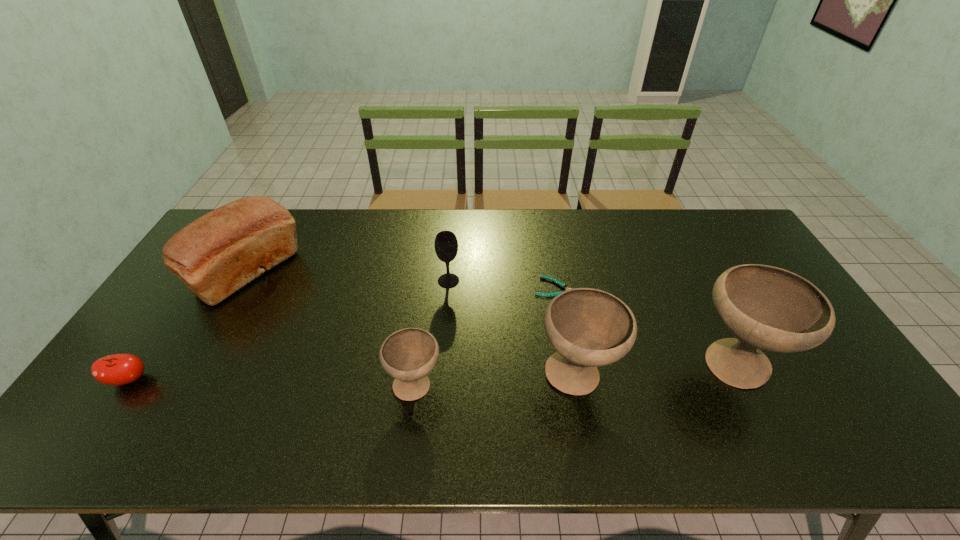
This screenshot has height=540, width=960. What are the coordinates of `vacant space that's between the wineglass and the second shortest object` in the screenshot? It's located at (289, 330).

Locate an element on the screen. Image resolution: width=960 pixels, height=540 pixels. vacant space that is in between the pliers and the apple is located at coordinates (344, 333).

Identify the location of vacant region between the second shortest object and the fourth tallest object. (289, 330).

I want to click on free space between the bread and the second shortest object, so click(189, 326).

Choose which object is the second nearest neighbor to the fourth shortest object. Please provide its 2D coordinates. Your answer should be formatted as a tuple, i.e. [(x, y)], where the tuple contains the x and y coordinates of a point satisfying the conditions above.

[(408, 355)]

Identify which object is located as the nearest to the fourth tallest object. Please provide its 2D coordinates. Your answer should be formatted as a tuple, i.e. [(x, y)], where the tuple contains the x and y coordinates of a point satisfying the conditions above.

[(562, 285)]

The image size is (960, 540). Find the location of `the second closest chalice to the shortest object`. the second closest chalice to the shortest object is located at coordinates (767, 308).

Point out which chalice is positioned as the second nearest to the pliers. Please provide its 2D coordinates. Your answer should be formatted as a tuple, i.e. [(x, y)], where the tuple contains the x and y coordinates of a point satisfying the conditions above.

[(767, 308)]

Image resolution: width=960 pixels, height=540 pixels. In order to click on free location that satisfies the following two spatial constraints: 1. on the back side of the apple; 2. on the right side of the rightmost object in this screenshot , I will do `click(139, 366)`.

The height and width of the screenshot is (540, 960). Identify the location of free location that satisfies the following two spatial constraints: 1. on the front side of the bread; 2. on the left side of the second chalice from left to right. (190, 376).